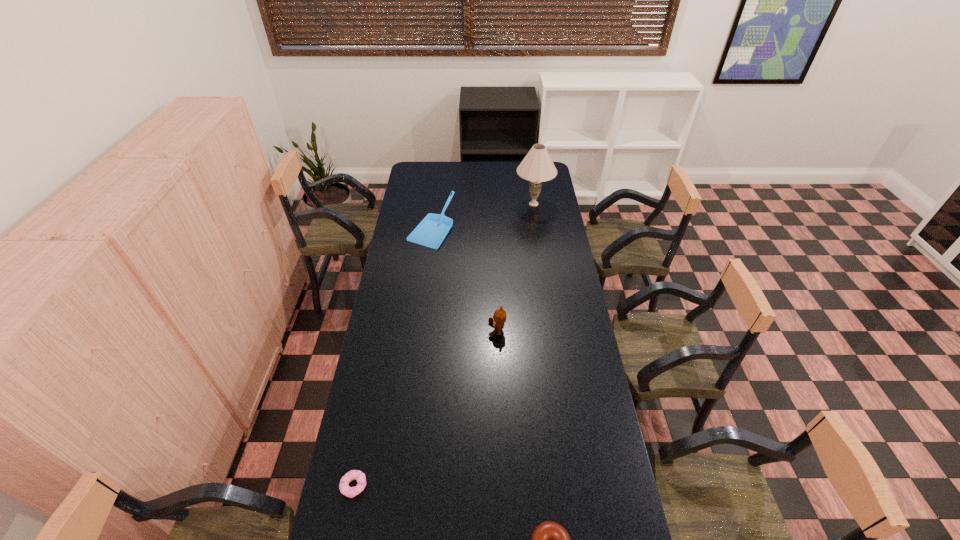
Image resolution: width=960 pixels, height=540 pixels. I want to click on free point located 0.390m on the front of the dustpan, so click(421, 308).

At what (x,y) coordinates should I click in order to perform the action: click on vacant space situated 0.070m on the front of the shortest object. Please return your answer as a coordinate pair (x, y). The width and height of the screenshot is (960, 540). Looking at the image, I should click on (347, 525).

You are a GUI agent. You are given a task and a screenshot of the screen. Output one action in this format:
    pyautogui.click(x=<x>, y=<y>)
    Task: Click on the dustpan located in the left edge section of the desktop
    
    Given the screenshot: What is the action you would take?
    pyautogui.click(x=432, y=230)

Where is `doughnut that is positioned at the left edge`? doughnut that is positioned at the left edge is located at coordinates (345, 489).

At what (x,y) coordinates should I click in order to perform the action: click on object that is at the right edge. Please return your answer as a coordinate pair (x, y). This screenshot has height=540, width=960. Looking at the image, I should click on (537, 166).

Where is `free region at the far edge of the desktop`? The image size is (960, 540). free region at the far edge of the desktop is located at coordinates (451, 176).

At what (x,y) coordinates should I click in order to perform the action: click on free space at the left edge of the desktop. Please return your answer as a coordinate pair (x, y). This screenshot has height=540, width=960. Looking at the image, I should click on point(430,212).

Find the location of a particular element. The height and width of the screenshot is (540, 960). vacant region at the right edge of the desktop is located at coordinates (557, 201).

The image size is (960, 540). What are the coordinates of `vacant space at the far left corner of the desktop` in the screenshot? It's located at (408, 176).

Image resolution: width=960 pixels, height=540 pixels. In order to click on vacant space that's between the tallest object and the dustpan in this screenshot , I will do `click(483, 215)`.